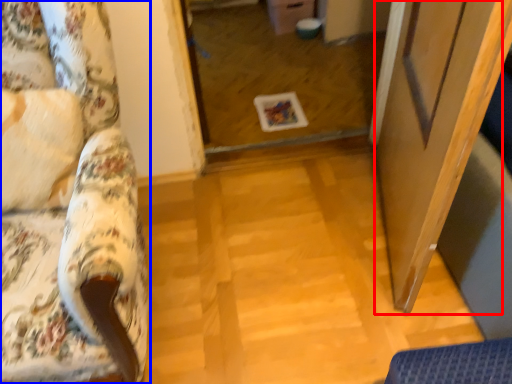
Question: Which object is further to the camera taking this photo, screen door (highlighted by a red box) or furniture (highlighted by a blue box)?

Choices:
 (A) screen door
 (B) furniture

Answer: (A)